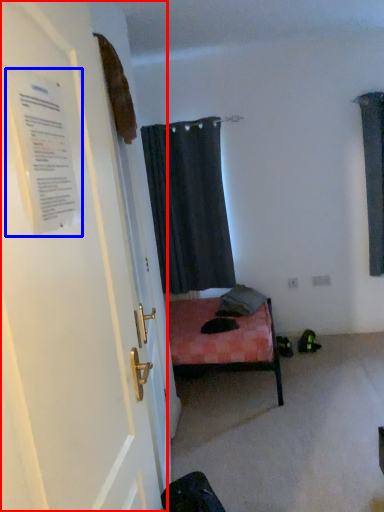
Question: Which point is further to the camera, door (highlighted by a red box) or poster (highlighted by a blue box)?

Choices:
 (A) door
 (B) poster

Answer: (B)